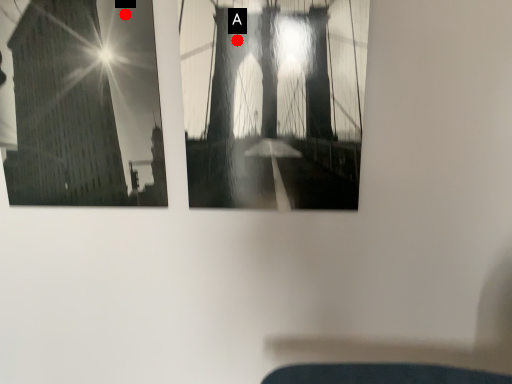
Question: Two points are circled on the image, labeled by A and B beside each circle. Which point appears closest to the camera in this image?

Choices:
 (A) A is closer
 (B) B is closer

Answer: (A)